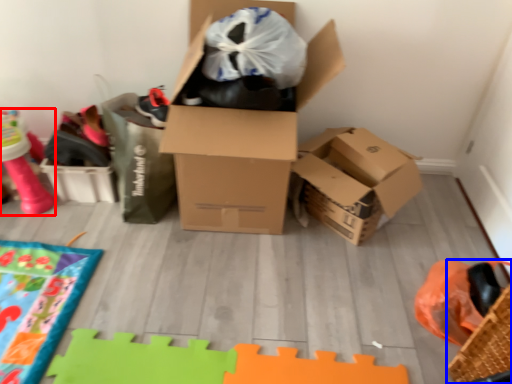
Question: Which of the following is the farthest to the observer, toy (highlighted by a red box) or basket (highlighted by a blue box)?

Choices:
 (A) toy
 (B) basket

Answer: (A)